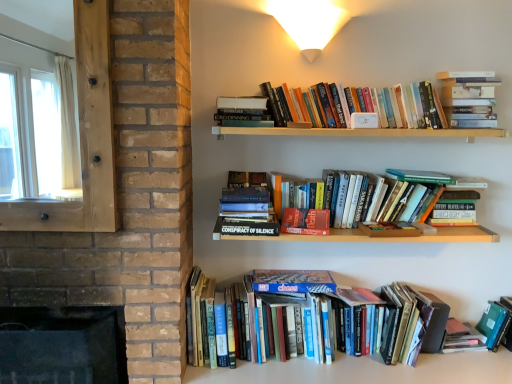
Find the location of a particular element. free space in front of hardcover book at lower right, which appears as the 1th paperback book when ordered from the bottom is located at coordinates (466, 365).